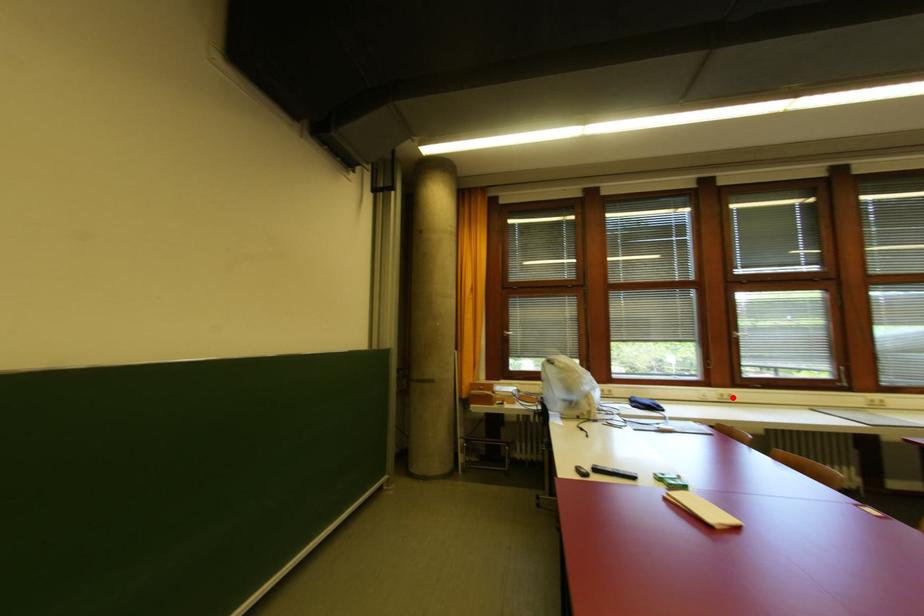
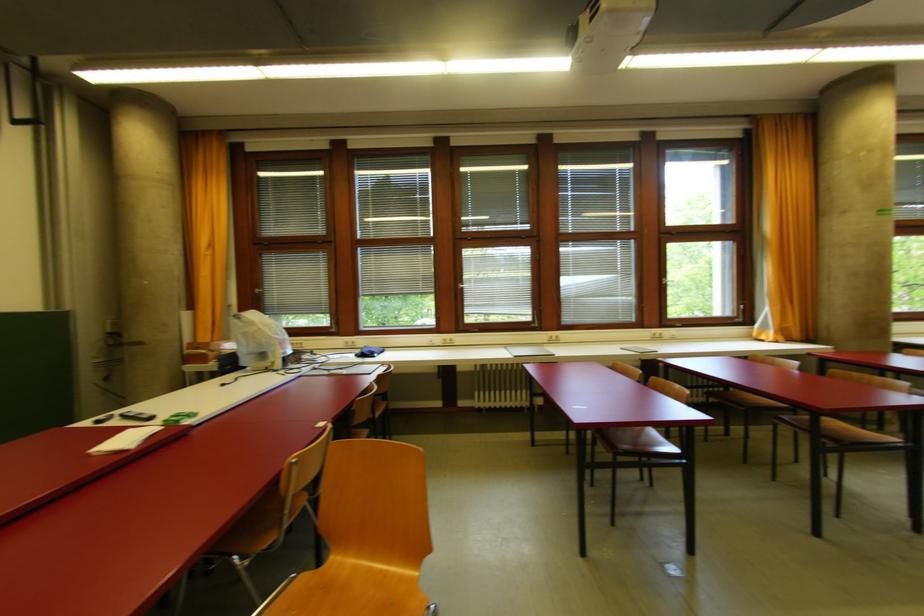
Locate, in the second image, the point that corresponds to the highlighted location in the first image.

(454, 342)